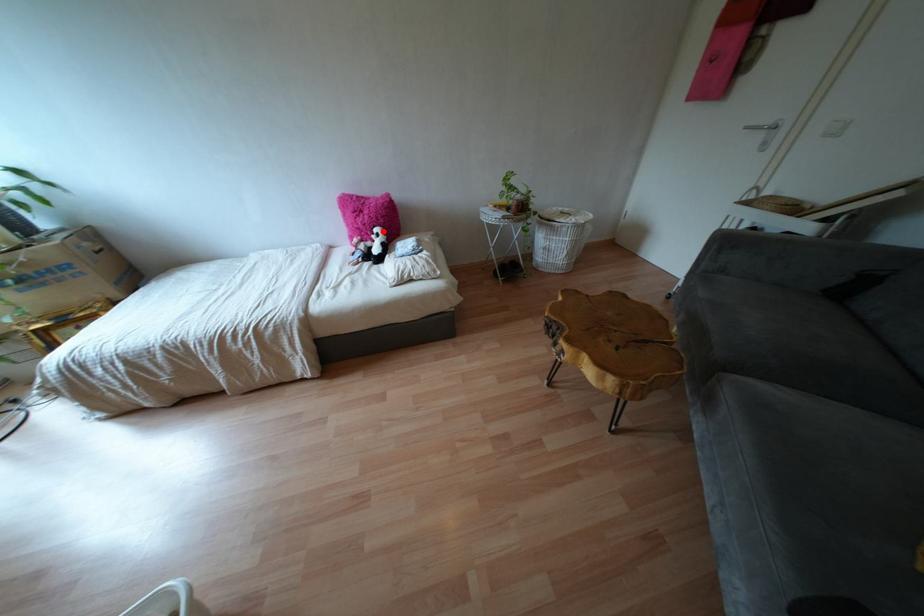
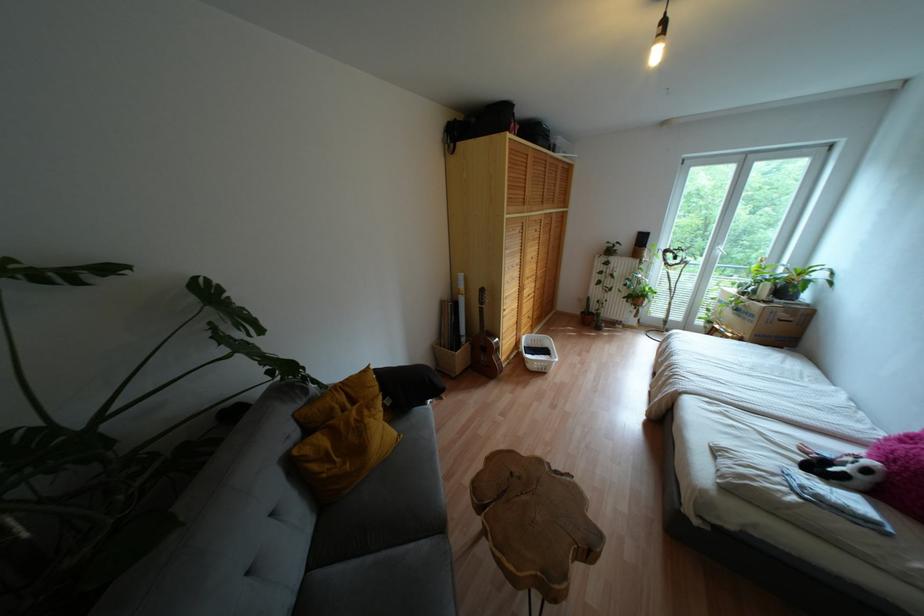
In the second image, find the point that corresponds to the highlighted location in the first image.

(867, 471)